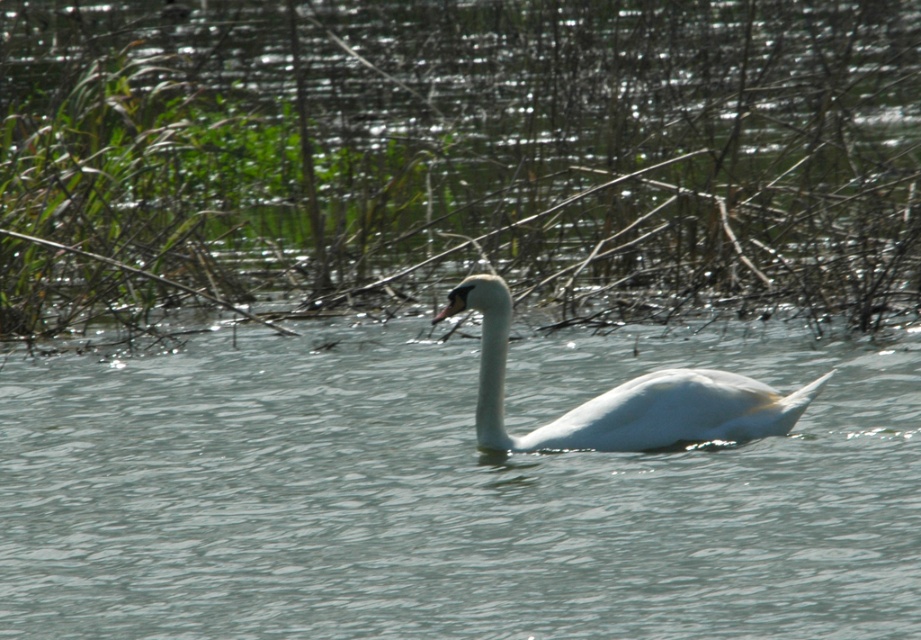
You are standing on the edge of a lake and see the clear water at center and the white glossy swan at center. Which object is positioned more to the left?

The clear water at center is positioned to the left of the white glossy swan at center.